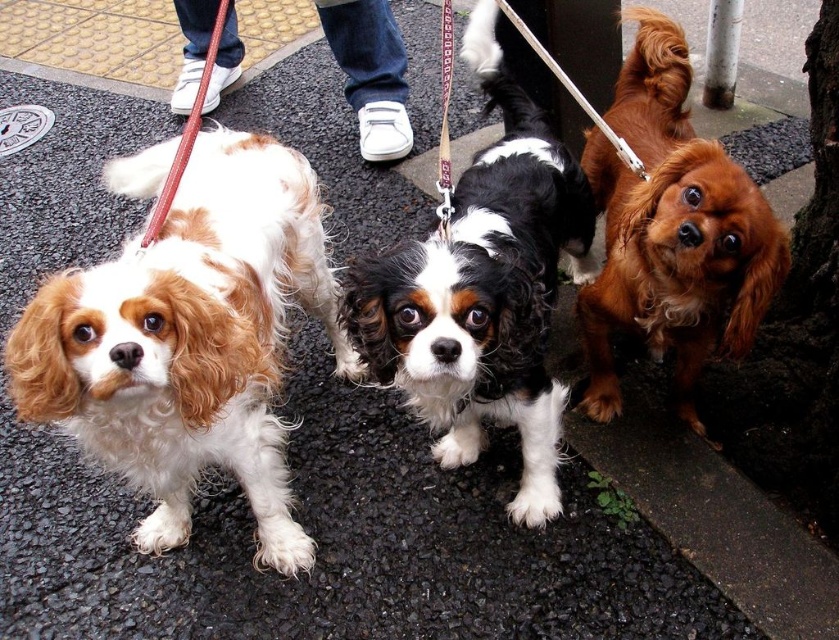
Does shiny brown fur at center lie behind red leather leash at left?

That is False.

Find the location of a particular element. shiny brown fur at center is located at coordinates (676, 262).

Which is above, shiny brown fur at center or white nylon leash at upper center?

white nylon leash at upper center is above.

Does shiny brown fur at center have a lesser height compared to white nylon leash at upper center?

Incorrect, shiny brown fur at center's height does not fall short of white nylon leash at upper center's.

Where is `shiny brown fur at center`? The image size is (839, 640). shiny brown fur at center is located at coordinates (676, 262).

I want to click on shiny brown fur at center, so click(x=676, y=262).

Does black and white fur at center lie in front of red leather leash at left?

Yes.

Describe the element at coordinates (483, 298) in the screenshot. I see `black and white fur at center` at that location.

The image size is (839, 640). I want to click on black and white fur at center, so 483,298.